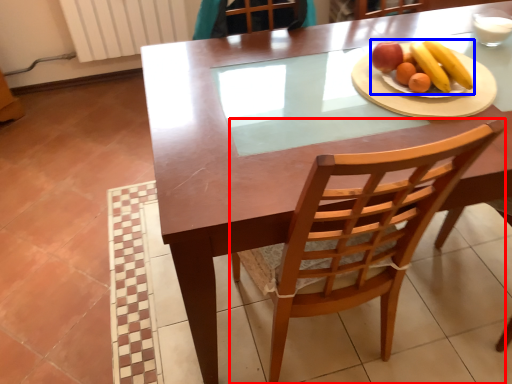
Question: Which object is closer to the camera taking this photo, chair (highlighted by a red box) or fruit dish (highlighted by a blue box)?

Choices:
 (A) chair
 (B) fruit dish

Answer: (A)